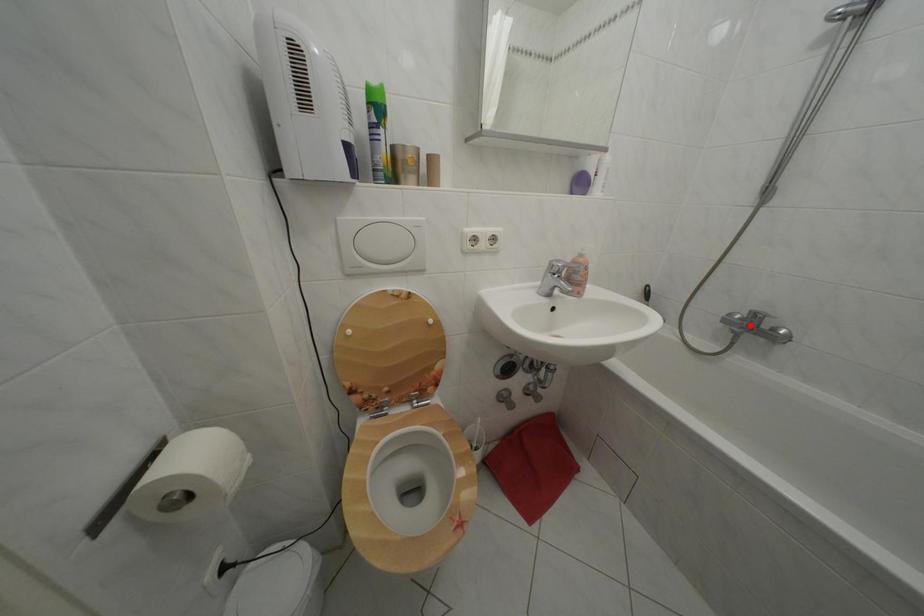
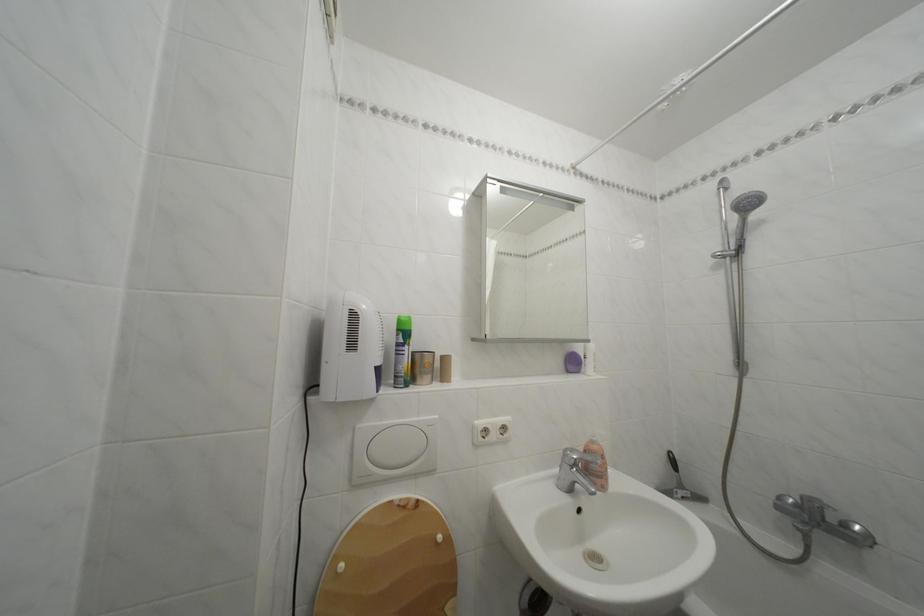
The point at the highlighted location is marked in the first image. Where is the corresponding point in the second image?

(806, 512)